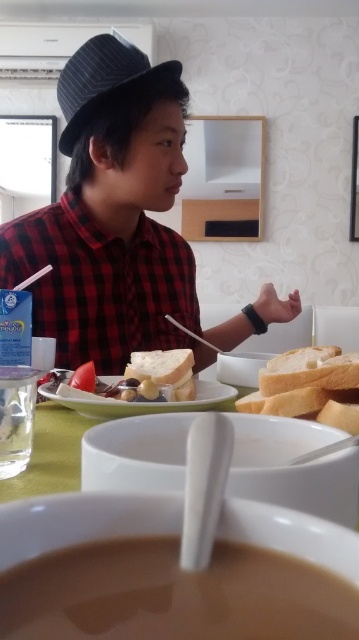
What is located at the coordinates point (174, 595) in the image?

The coordinates point (174, 595) mark the brown matte soup at lower center.

You are a photographer trying to capture a closeup of the white matte bread at center without including the red checkered shirt at left in the frame. Given their sizes, can you do this?

The red checkered shirt at left has a larger size compared to white matte bread at center. Since the shirt is larger, it might be challenging to frame the bread without including the shirt unless the camera is positioned very close to the bread to minimize the shirt in the background.